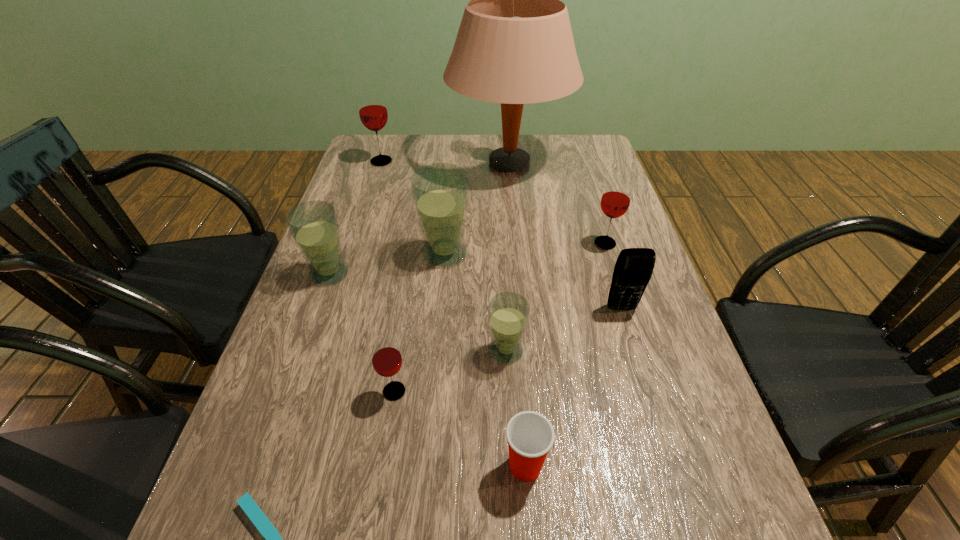
Identify the location of vacant region located on the left of the rightmost red glass. (447, 244).

What are the coordinates of `vacant space situated on the front of the leftmost blue glass` in the screenshot? It's located at (300, 359).

Where is `vacant space located 0.400m on the screen of the cellular telephone`? This screenshot has width=960, height=540. vacant space located 0.400m on the screen of the cellular telephone is located at coordinates (682, 505).

Find the location of a particular element. This screenshot has width=960, height=540. vacant space located on the right of the nearest glass is located at coordinates (487, 392).

Image resolution: width=960 pixels, height=540 pixels. What are the coordinates of `vacant space located on the left of the second nearest glass` in the screenshot? It's located at (294, 350).

This screenshot has height=540, width=960. Identify the location of free region located on the back of the red Dixie cup. (520, 399).

Image resolution: width=960 pixels, height=540 pixels. What are the coordinates of `lampshade located at the far edge` in the screenshot? It's located at (514, 46).

Find the location of a particular element. This screenshot has width=960, height=540. glass situated at the far edge is located at coordinates (373, 113).

I want to click on lampshade that is positioned at the right edge, so click(x=514, y=46).

You are a GUI agent. You are given a task and a screenshot of the screen. Output one action in this format:
    pyautogui.click(x=<x>, y=<y>)
    Task: Click on the glass that is positioned at the right edge
    This screenshot has width=960, height=540.
    Given the screenshot: What is the action you would take?
    pyautogui.click(x=615, y=201)